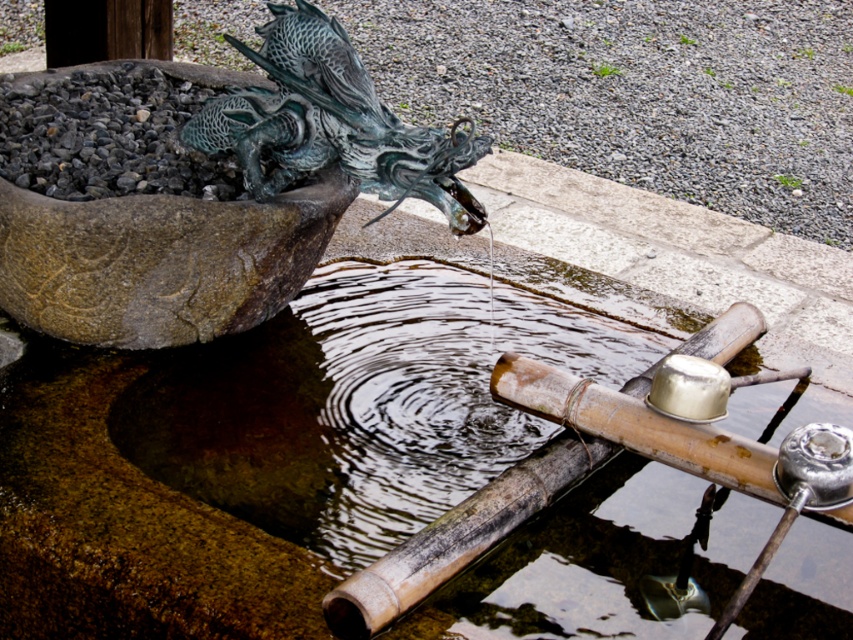
In the scene shown: Does brown bamboo water feature at center appear on the right side of green patina metal dragon at upper left?

Indeed, brown bamboo water feature at center is positioned on the right side of green patina metal dragon at upper left.

Which is behind, point (187, 483) or point (416, 172)?

Positioned behind is point (187, 483).

Image resolution: width=853 pixels, height=640 pixels. In order to click on brown bamboo water feature at center in this screenshot , I will do tap(245, 460).